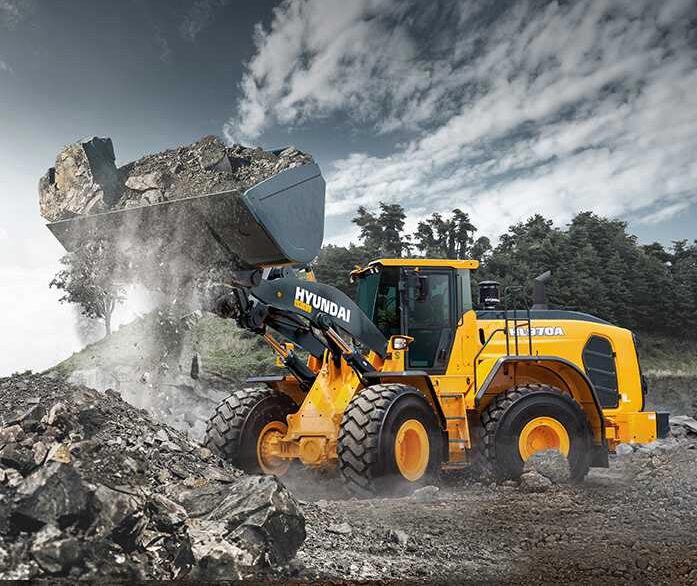
You are a GUI agent. You are given a task and a screenshot of the screen. Output one action in this format:
    pyautogui.click(x=<x>, y=<y>)
    Task: Click on the window
    The image size is (697, 586).
    Given the screenshot: What is the action you would take?
    pyautogui.click(x=406, y=302)